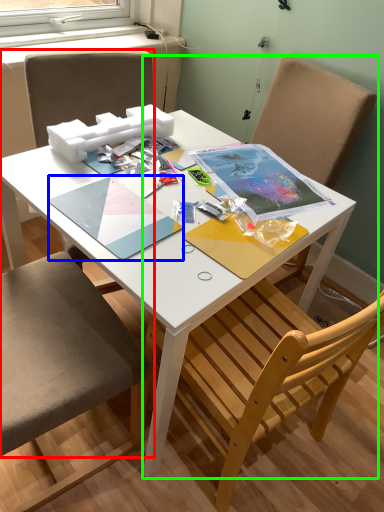
Question: Estimate the real-world distances between objects in this image. Which object is farther from chair (highlighted by a red box), notebook (highlighted by a blue box) or chair (highlighted by a green box)?

Choices:
 (A) notebook
 (B) chair

Answer: (B)